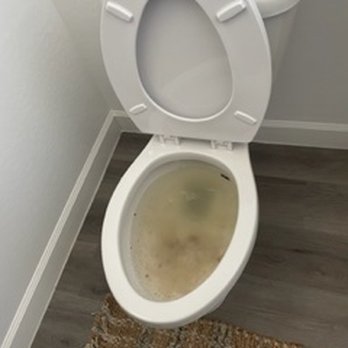
This screenshot has width=348, height=348. Identify the location of toilet bowl rim. (158, 154), (242, 252).